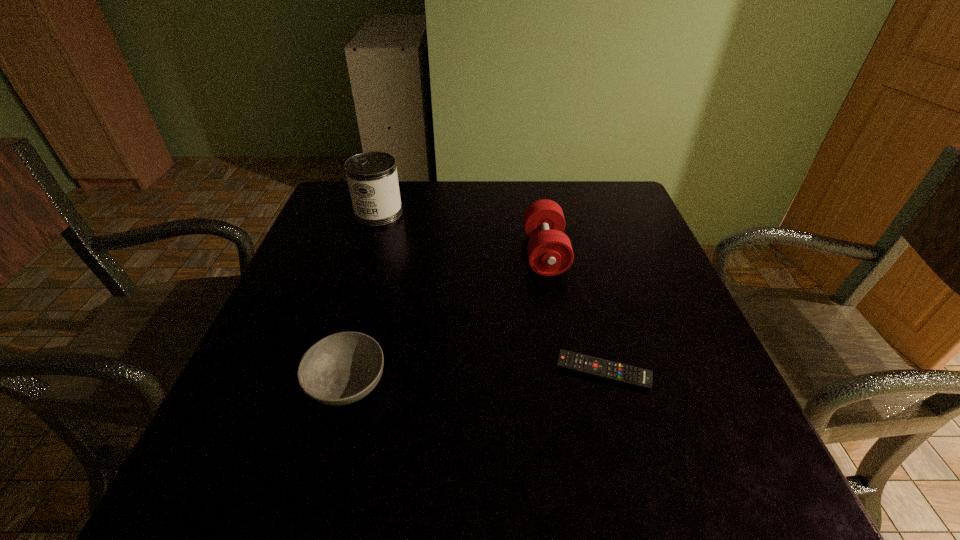
This screenshot has height=540, width=960. Find the location of `the tallest object`. the tallest object is located at coordinates (372, 178).

Where is `can`? The image size is (960, 540). can is located at coordinates (372, 178).

This screenshot has width=960, height=540. I want to click on the second tallest object, so click(550, 253).

Where is `the third nearest object`? The image size is (960, 540). the third nearest object is located at coordinates (550, 253).

Where is `the third tallest object`? This screenshot has width=960, height=540. the third tallest object is located at coordinates (342, 368).

Locate an element on the screen. This screenshot has width=960, height=540. the shortest object is located at coordinates (596, 367).

At what (x,y) coordinates should I click in order to perform the action: click on vacant space located 0.080m on the left of the farthest object. Please return your answer as a coordinate pair (x, y). Looking at the image, I should click on (324, 213).

Locate an element on the screen. free spot located on the front of the dumbbell is located at coordinates (576, 428).

Image resolution: width=960 pixels, height=540 pixels. In order to click on free spot located 0.320m on the right of the bowl in this screenshot , I will do `click(578, 383)`.

Locate an element on the screen. vacant region located on the left of the remote control is located at coordinates (481, 372).